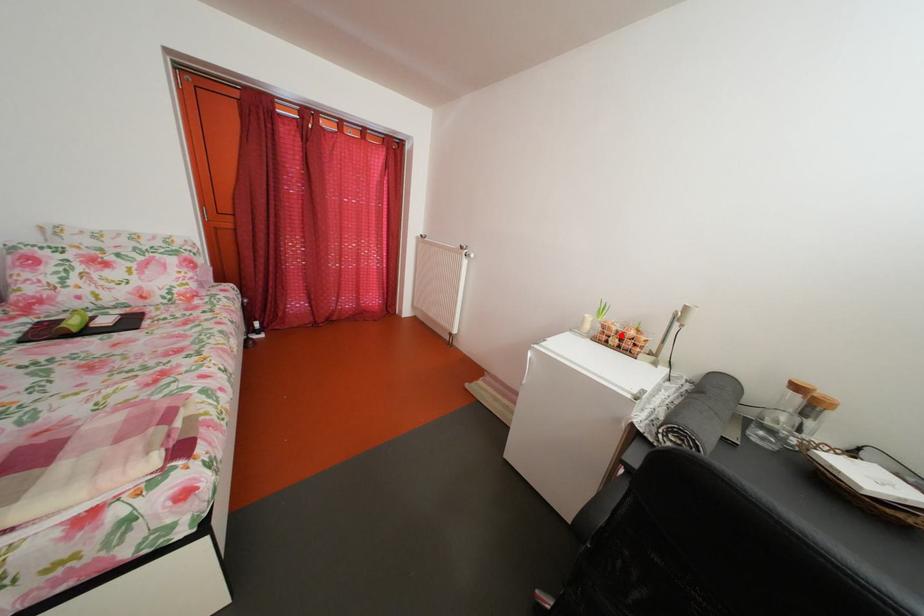
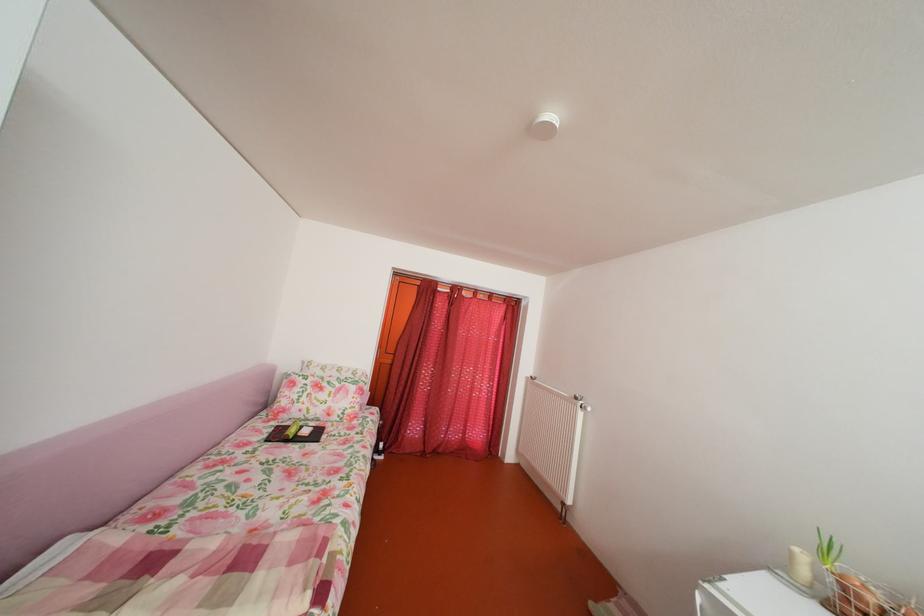
Question: I am providing you with two images of the same scene from different viewpoints. Image1 has a red point marked. In image2, the corresponding 3D location appears at what relative position? Reply with the corresponding letter.

Choices:
 (A) Closer
 (B) Farther

Answer: (A)